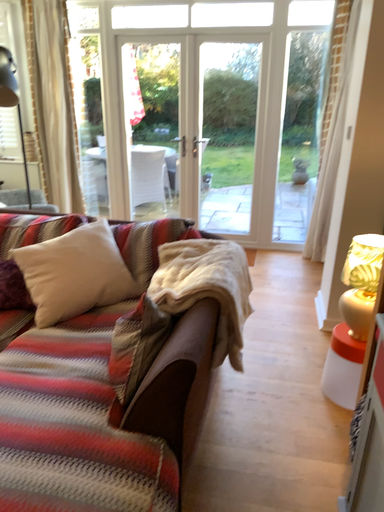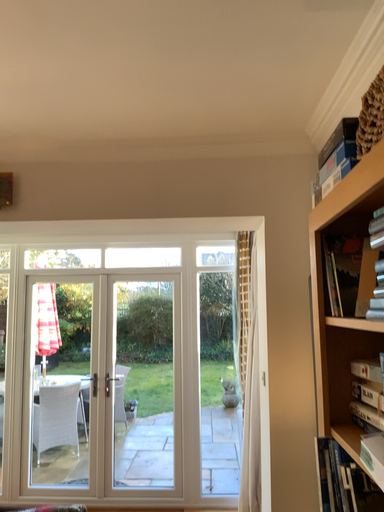
Question: How did the camera likely rotate when shooting the video?

Choices:
 (A) rotated upward
 (B) rotated downward

Answer: (A)